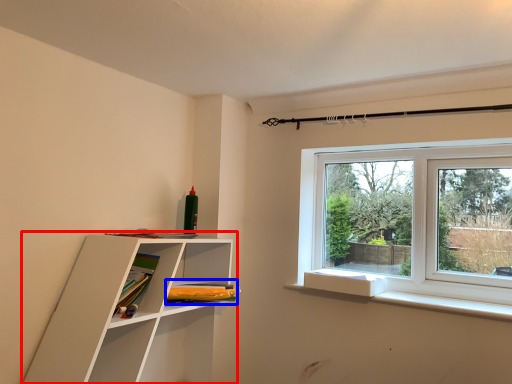
Question: Which point is closer to the camera, shelf (highlighted by a red box) or book (highlighted by a blue box)?

Choices:
 (A) shelf
 (B) book

Answer: (A)